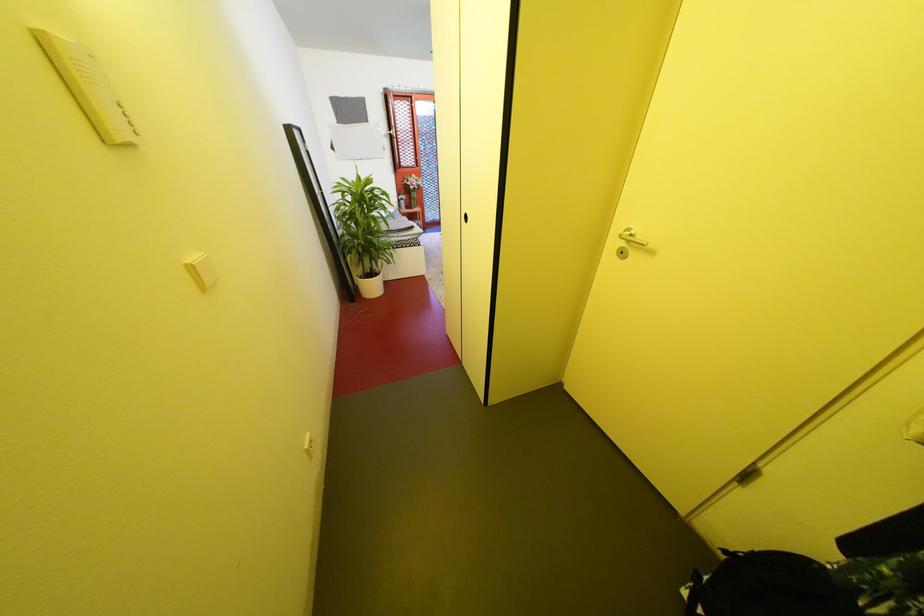
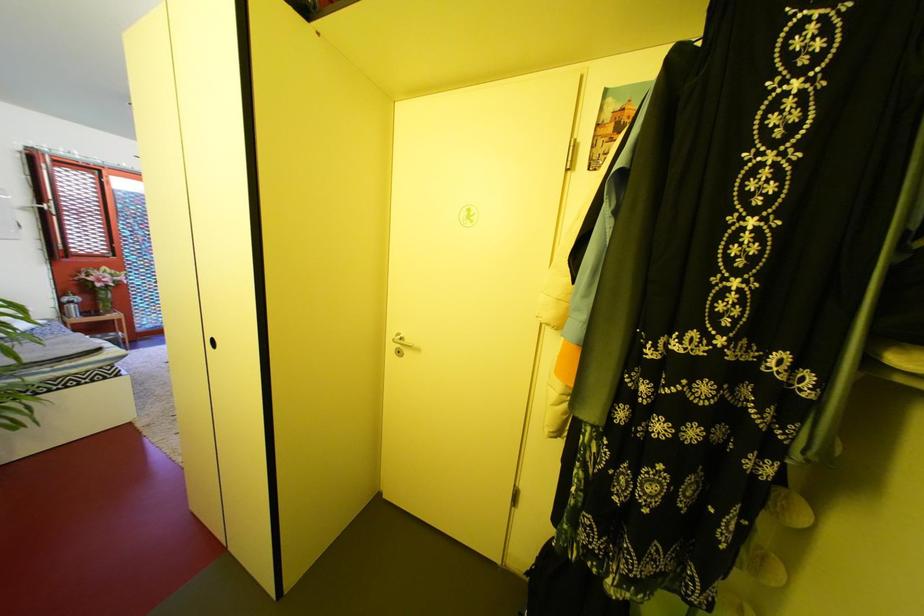
Question: The camera is either moving clockwise (left) or counter-clockwise (right) around the object. The first image is from the beginning of the video and the second image is from the end. Is the camera moving left or right when shooting the video?

Choices:
 (A) Left
 (B) Right

Answer: (A)